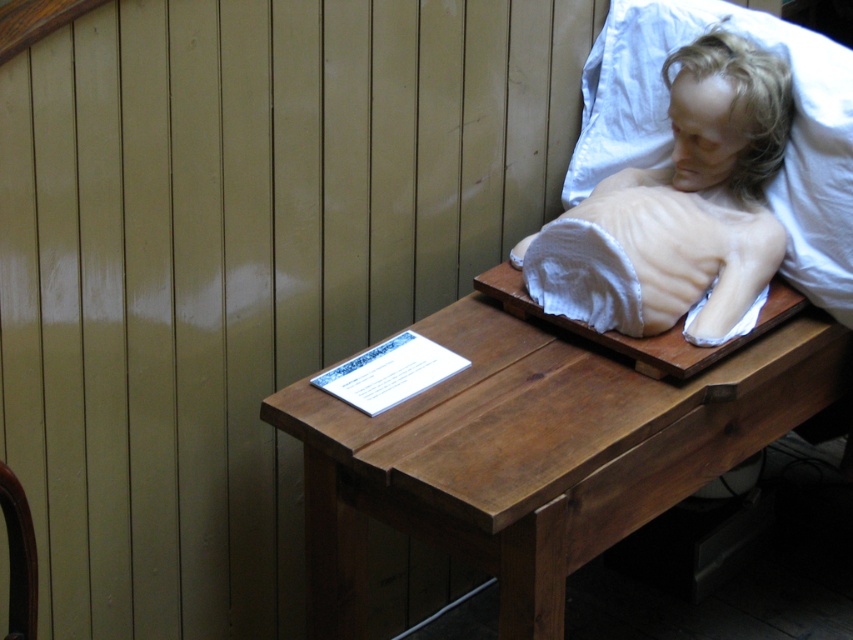
Question: Among these objects, which one is farthest from the camera?

Choices:
 (A) wooden table at center
 (B) smooth beige wax at upper right

Answer: (B)

Question: Does wooden table at center have a larger size compared to smooth beige wax at upper right?

Choices:
 (A) no
 (B) yes

Answer: (B)

Question: Can you confirm if wooden table at center is positioned to the right of smooth beige wax at upper right?

Choices:
 (A) yes
 (B) no

Answer: (B)

Question: Which object is farther from the camera taking this photo?

Choices:
 (A) smooth beige wax at upper right
 (B) wooden table at center

Answer: (A)

Question: Does wooden table at center have a greater width compared to smooth beige wax at upper right?

Choices:
 (A) no
 (B) yes

Answer: (B)